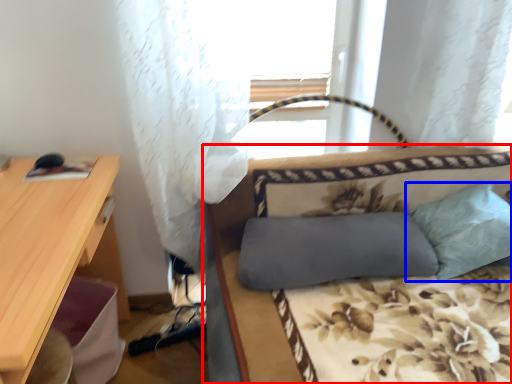
Question: Among these objects, which one is farthest to the camera, studio couch (highlighted by a red box) or pillow (highlighted by a blue box)?

Choices:
 (A) studio couch
 (B) pillow

Answer: (B)